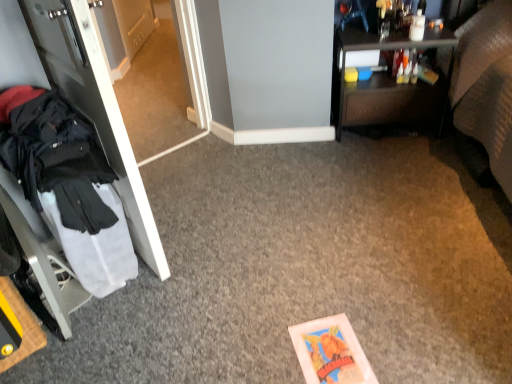
Where is `vacant space that's between white glossy door at left and dark brown wood desk at upper right`? The image size is (512, 384). vacant space that's between white glossy door at left and dark brown wood desk at upper right is located at coordinates (256, 186).